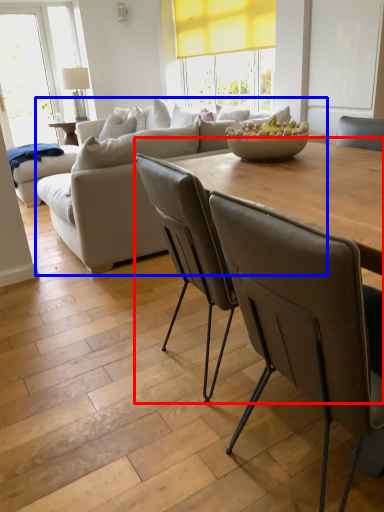
Question: Which object appears closest to the camera in this image, table (highlighted by a red box) or studio couch (highlighted by a blue box)?

Choices:
 (A) table
 (B) studio couch

Answer: (A)